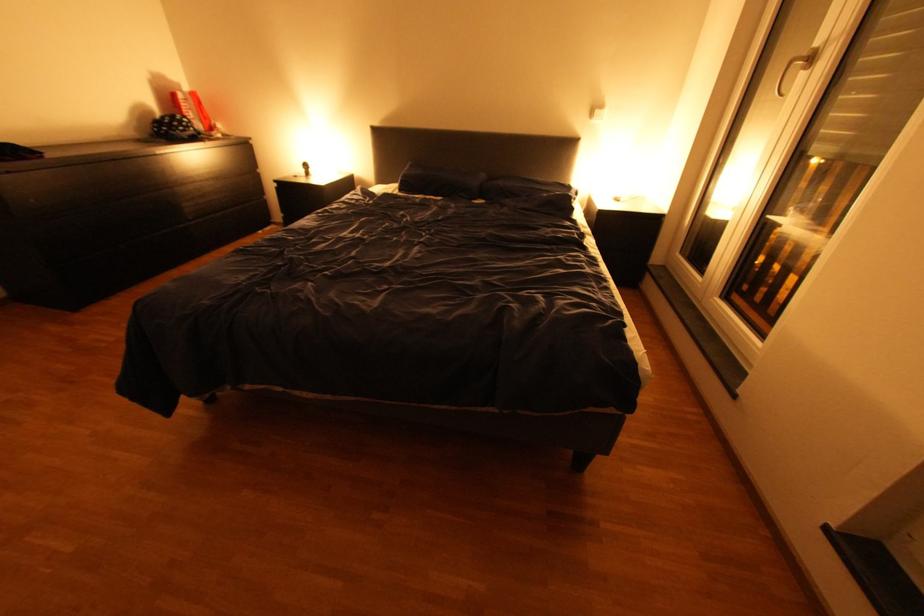
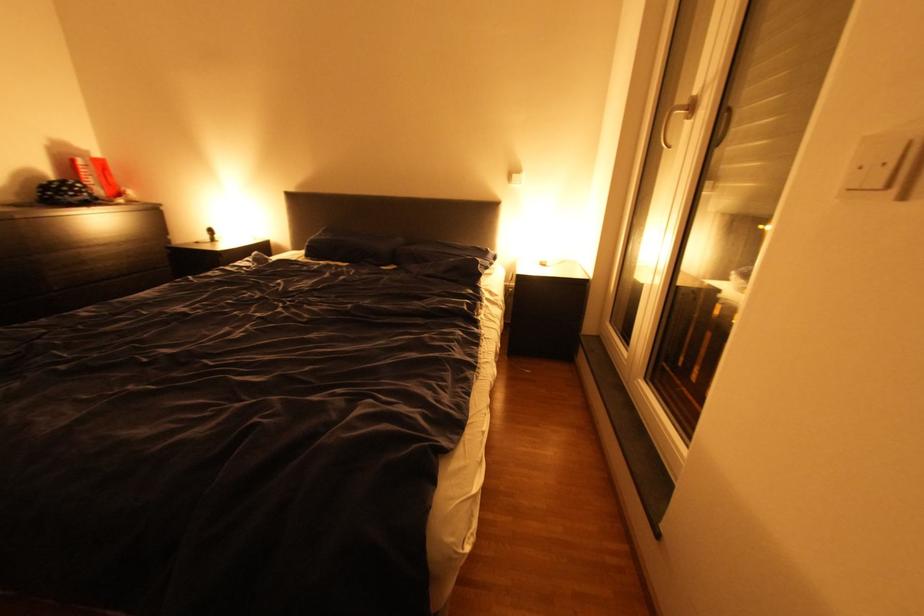
Question: Based on the continuous images, in which direction is the camera rotating? Reply with the corresponding letter.

Choices:
 (A) Left
 (B) Right
 (C) Up
 (D) Down

Answer: (C)